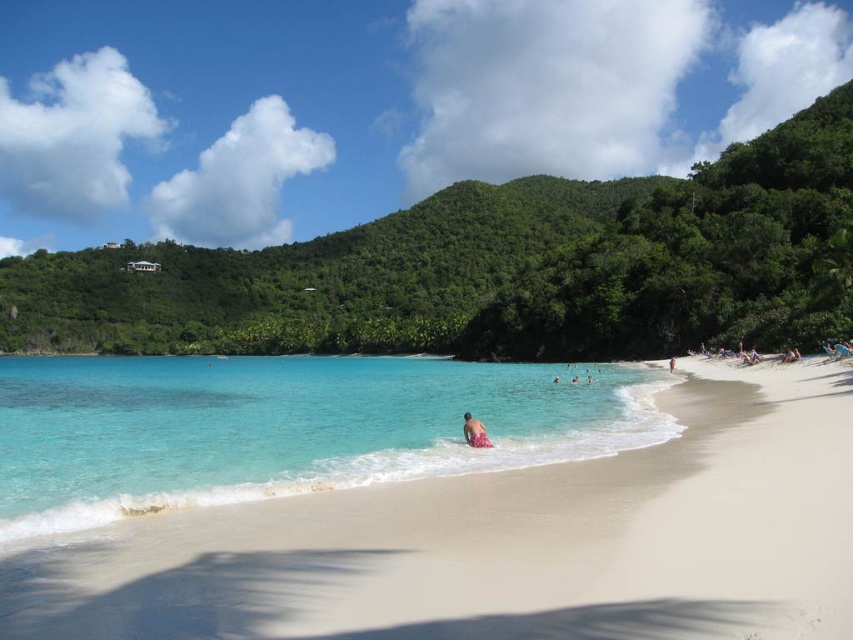
Question: Is clear blue water at center above pink fabric at lower center?

Choices:
 (A) no
 (B) yes

Answer: (A)

Question: Which object appears closest to the camera in this image?

Choices:
 (A) pink fabric at lower center
 (B) clear blue water at center

Answer: (B)

Question: Which of the following is the closest to the observer?

Choices:
 (A) pink fabric at lower center
 (B) clear blue water at center

Answer: (B)

Question: Does clear blue water at center have a larger size compared to pink fabric at lower center?

Choices:
 (A) yes
 (B) no

Answer: (A)

Question: Is clear blue water at center below pink fabric at lower center?

Choices:
 (A) no
 (B) yes

Answer: (B)

Question: Which point appears farthest from the camera in this image?

Choices:
 (A) (100, 444)
 (B) (462, 432)

Answer: (B)